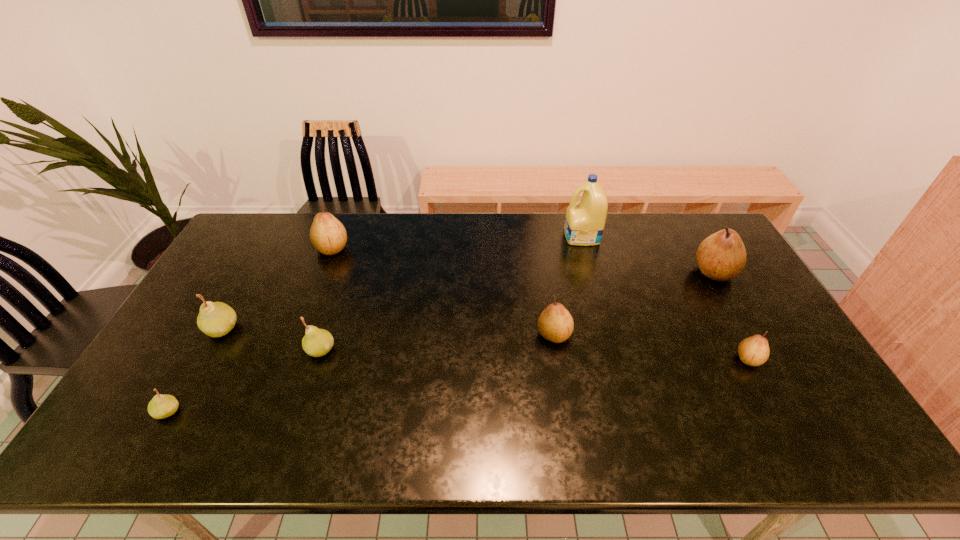
Locate an element on the screen. This screenshot has height=540, width=960. vacant space that satisfies the following two spatial constraints: 1. on the back side of the leftmost brown pear; 2. on the right side of the biggest green pear is located at coordinates pos(267,248).

Identify the location of vacant space that satisfies the following two spatial constraints: 1. on the back side of the leftmost brown pear; 2. on the right side of the biggest green pear. (267, 248).

This screenshot has width=960, height=540. I want to click on vacant space that satisfies the following two spatial constraints: 1. on the back side of the smallest brown pear; 2. on the left side of the nearest green pear, so click(x=198, y=359).

Locate an element on the screen. The width and height of the screenshot is (960, 540). blank area in the image that satisfies the following two spatial constraints: 1. on the label of the smallest brown pear; 2. on the left side of the tallest object is located at coordinates (615, 359).